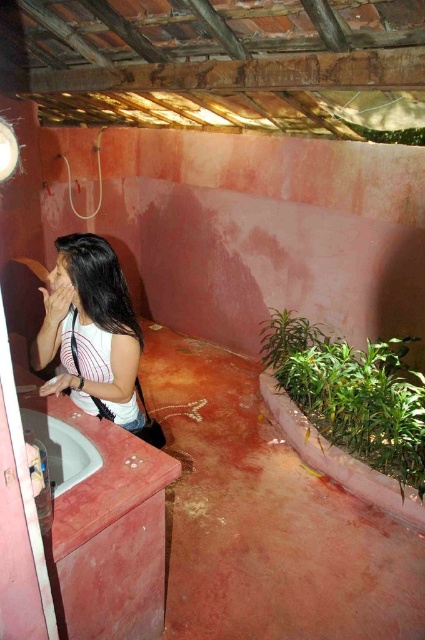
You are standing in the outdoor bathroom and want to place a small plant between the two points labeled point (85, 298) and point (51, 449). Which point should the plant be closer to in order to be closer to the camera?

The plant should be closer to point (85, 298) because it is further to the camera than point (51, 449).

You are a photographer trying to capture the white striped shirt at left and the white glossy sink at lower left in the same frame. However, the shirt is partially blocking the sink. Can you adjust your position to see both objects clearly without moving the shirt?

The white striped shirt at left is positioned over the white glossy sink at lower left, so moving the camera position slightly downward or to the side might allow both objects to be seen clearly without moving the shirt.

You are a photographer setting up a shoot in the bathroom. You need to position a 1.2 meter tall mannequin wearing a white striped shirt at left so that it doesn not block the view of the white glossy sink at lower left. Is the mannequin tall enough to block the sink?

The white striped shirt at left is taller than the white glossy sink at lower left. Therefore, the mannequin wearing the white striped shirt at left would be taller than the sink, potentially blocking its view if positioned directly in front.